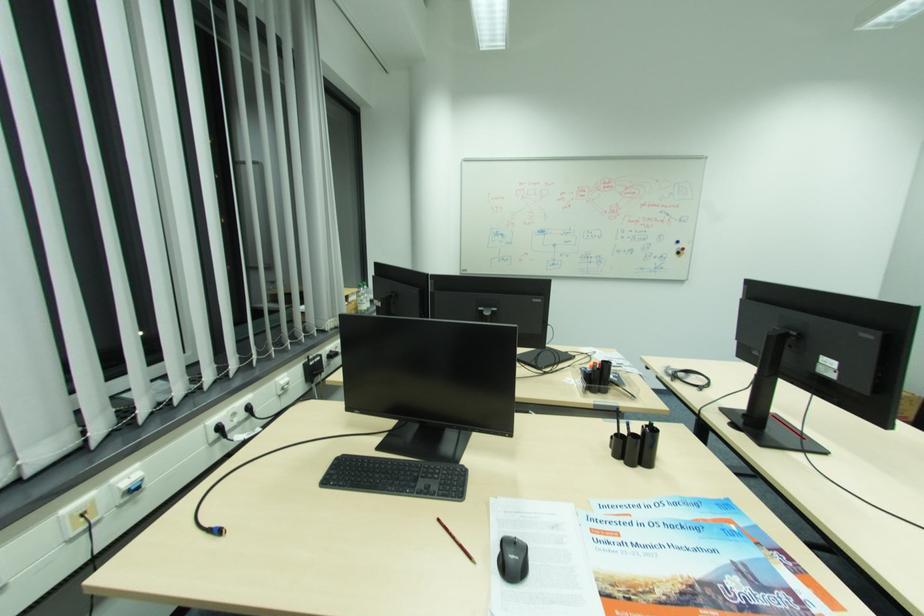
In order to click on green bottle cap in this screenshot , I will do `click(359, 283)`.